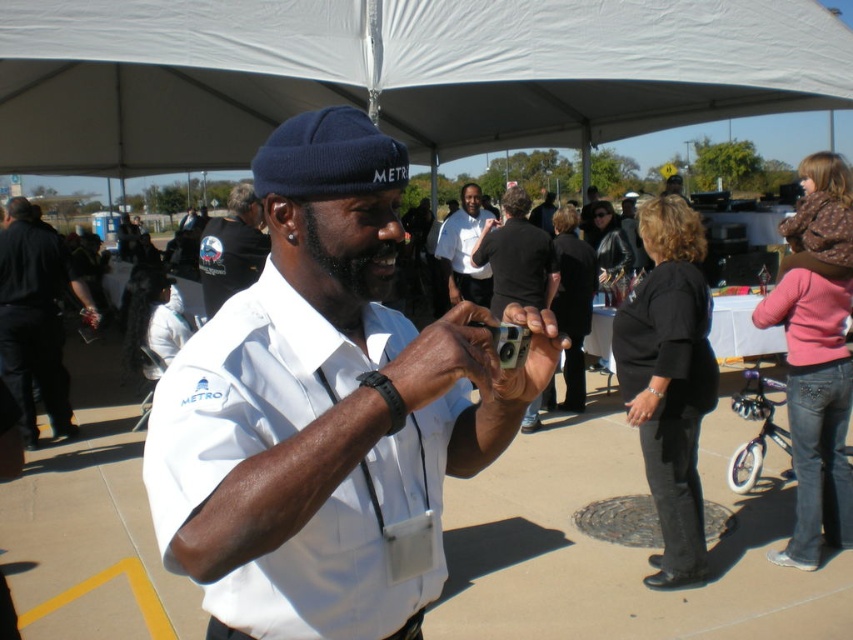
Question: Is white matte uniform at center above black fabric shirt at center?

Choices:
 (A) no
 (B) yes

Answer: (A)

Question: Is black fabric shirt at center bigger than white shirt at center?

Choices:
 (A) no
 (B) yes

Answer: (A)

Question: Which point is closer to the camera?

Choices:
 (A) (457, 234)
 (B) (277, 547)
 (C) (518, 337)

Answer: (B)

Question: Among these points, which one is nearest to the camera?

Choices:
 (A) (508, 342)
 (B) (194, 13)

Answer: (A)

Question: Is white shirt at center wider than metallic gray camera at center?

Choices:
 (A) yes
 (B) no

Answer: (A)

Question: Which object is the closest to the white shirt at center?

Choices:
 (A) white matte uniform at center
 (B) black fabric jacket at left

Answer: (B)